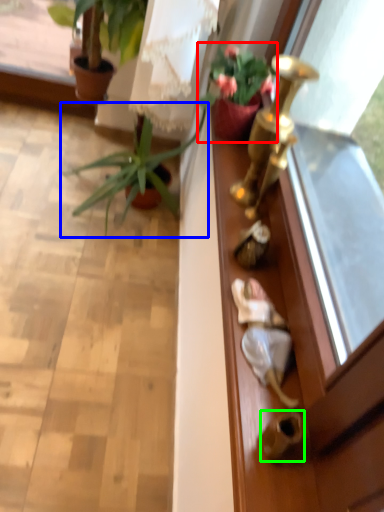
Question: Which is nearer to the houseplant (highlighted by a red box)? houseplant (highlighted by a blue box) or door handle (highlighted by a green box).

Choices:
 (A) houseplant
 (B) door handle

Answer: (A)